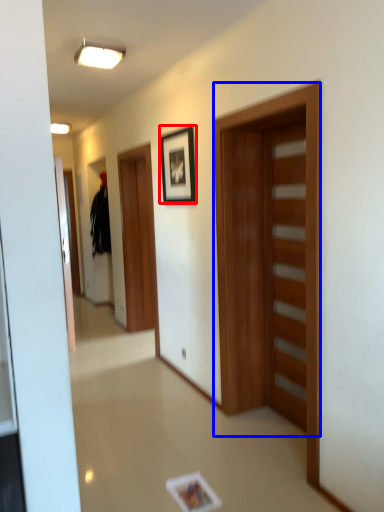
Question: Which point is further to the camera, picture frame (highlighted by a red box) or door (highlighted by a blue box)?

Choices:
 (A) picture frame
 (B) door

Answer: (A)